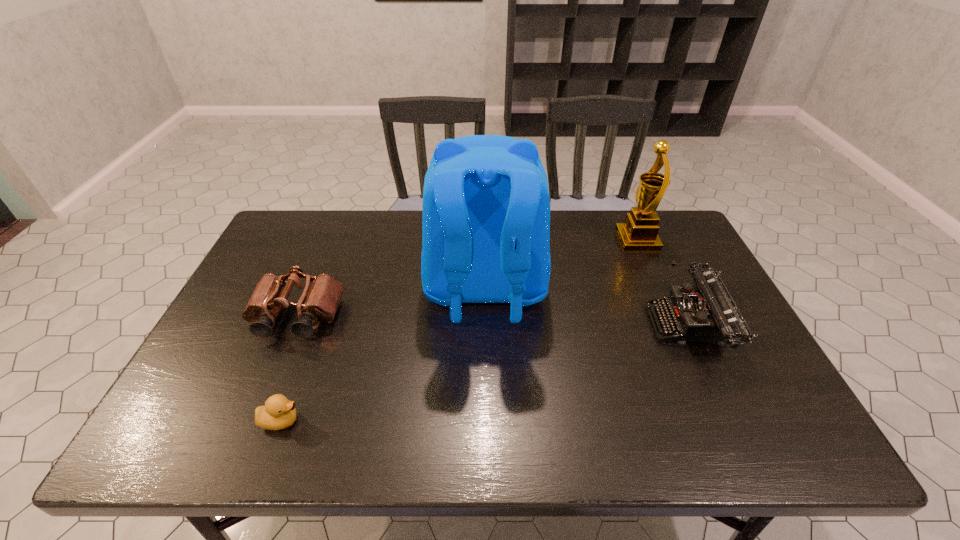
At what (x,y) coordinates should I click in order to perform the action: click on blank area in the image that satisfies the following two spatial constraints: 1. on the back of the tallest object; 2. on the face of the shortest object. Please return your answer as a coordinate pair (x, y). Looking at the image, I should click on (487, 421).